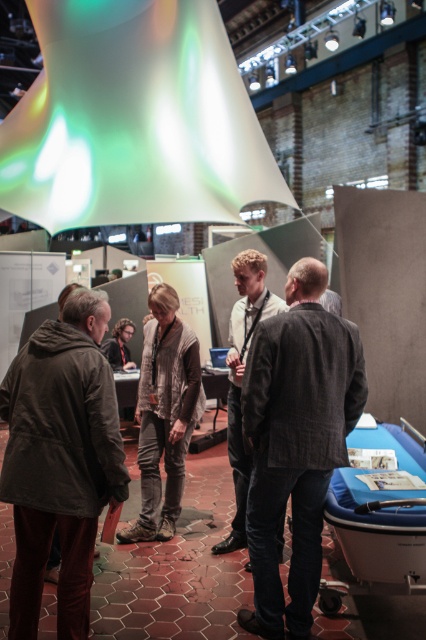
Question: Based on their relative distances, which object is farther from the brown fabric jacket at left?

Choices:
 (A) dark gray textured jacket at center
 (B) light brown leather jacket at center

Answer: (B)

Question: Among these objects, which one is nearest to the camera?

Choices:
 (A) brown fabric jacket at left
 (B) light brown leather jacket at center

Answer: (A)

Question: Can you confirm if dark gray textured jacket at center is positioned to the right of light brown leather jacket at center?

Choices:
 (A) no
 (B) yes

Answer: (B)

Question: Can you confirm if brown fabric jacket at left is bigger than light brown leather jacket at center?

Choices:
 (A) yes
 (B) no

Answer: (B)

Question: Estimate the real-world distances between objects in this image. Which object is closer to the light brown leather jacket at center?

Choices:
 (A) brown fabric jacket at left
 (B) dark gray textured jacket at center

Answer: (B)

Question: Can you confirm if brown fabric jacket at left is positioned below dark gray textured jacket at center?

Choices:
 (A) yes
 (B) no

Answer: (B)